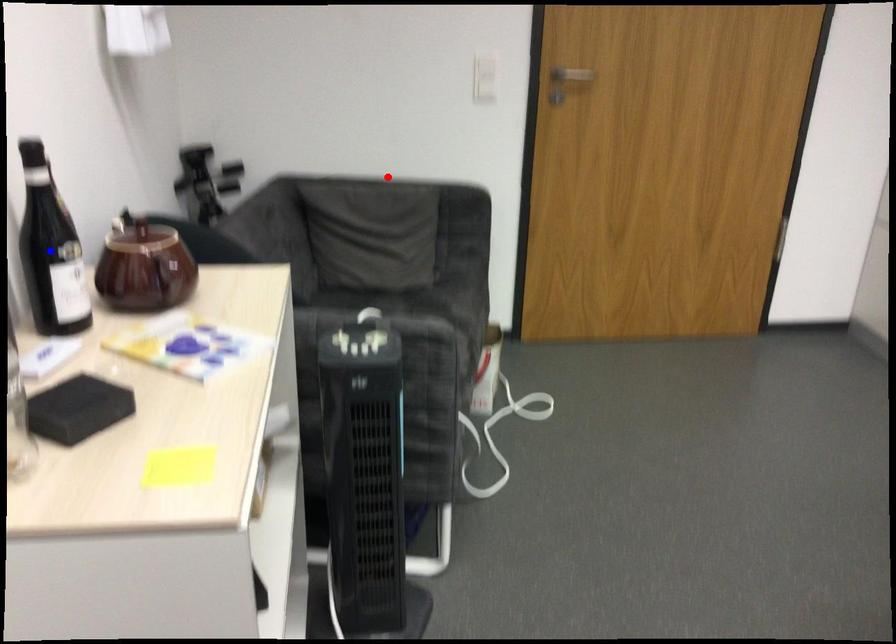
Question: Which of the two points in the image is closer to the camera?

Choices:
 (A) Blue point is closer.
 (B) Red point is closer.

Answer: (A)